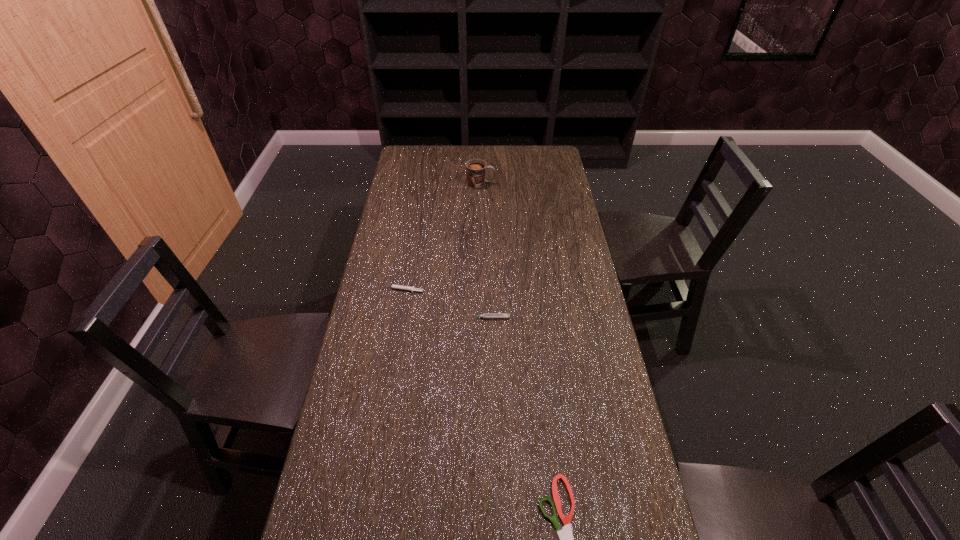
Where is `the tallest object`? The image size is (960, 540). the tallest object is located at coordinates (475, 169).

In order to click on the farthest object in this screenshot , I will do `click(475, 169)`.

Where is `the second tallest object`? This screenshot has height=540, width=960. the second tallest object is located at coordinates (485, 315).

The width and height of the screenshot is (960, 540). In order to click on the taller syringe in this screenshot , I will do `click(485, 315)`.

Where is `the third tallest object`? Image resolution: width=960 pixels, height=540 pixels. the third tallest object is located at coordinates (400, 287).

You are a GUI agent. You are given a task and a screenshot of the screen. Output one action in this format:
    pyautogui.click(x=<x>, y=<y>)
    Task: Click on the leftmost object
    
    Given the screenshot: What is the action you would take?
    pyautogui.click(x=400, y=287)

I want to click on vacant space located 0.180m on the side of the tallest object with the handle, so click(x=537, y=184).

Where is `free space located at the needle end of the nearer syringe`? Image resolution: width=960 pixels, height=540 pixels. free space located at the needle end of the nearer syringe is located at coordinates (387, 318).

Where is `free point located 0.050m at the needle end of the nearer syringe`? The width and height of the screenshot is (960, 540). free point located 0.050m at the needle end of the nearer syringe is located at coordinates (454, 318).

Where is `free space located at the needle end of the nearer syringe`? Image resolution: width=960 pixels, height=540 pixels. free space located at the needle end of the nearer syringe is located at coordinates (438, 318).